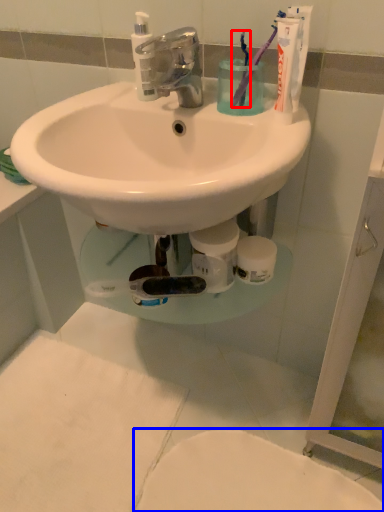
Question: Which of the following is the closest to the observer, toothbrush (highlighted by a red box) or toilet (highlighted by a blue box)?

Choices:
 (A) toothbrush
 (B) toilet

Answer: (A)